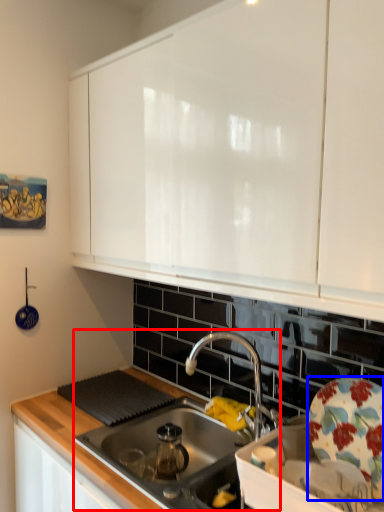
Question: Which object is closer to the camera taking this photo, sink (highlighted by a red box) or plate (highlighted by a blue box)?

Choices:
 (A) sink
 (B) plate

Answer: (B)